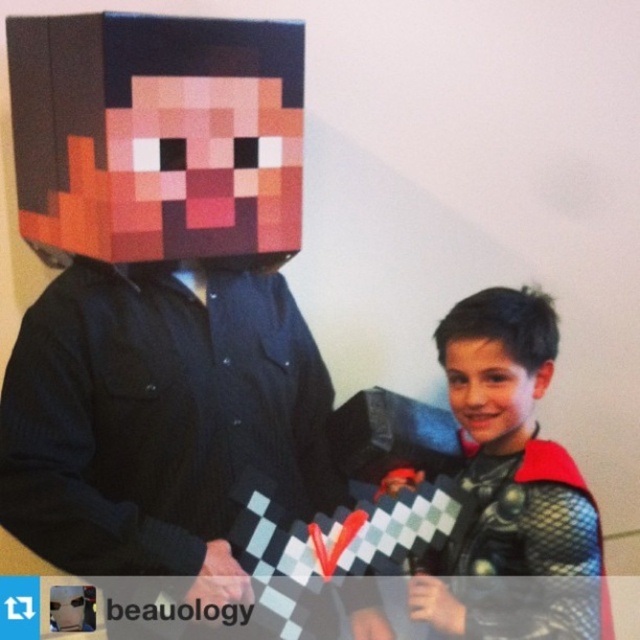
Question: Is matte black costume at center wider than smooth skin face at center?

Choices:
 (A) yes
 (B) no

Answer: (A)

Question: Observing the image, what is the correct spatial positioning of matte black costume at center in reference to dark brown hair at center?

Choices:
 (A) right
 (B) left

Answer: (A)

Question: Estimate the real-world distances between objects in this image. Which object is farther from the smooth skin face at center?

Choices:
 (A) matte black costume at center
 (B) dark brown hair at center

Answer: (A)

Question: Observing the image, what is the correct spatial positioning of dark brown hair at center in reference to smooth skin face at center?

Choices:
 (A) above
 (B) below

Answer: (A)

Question: Which is farther from the smooth skin face at center?

Choices:
 (A) dark brown hair at center
 (B) matte black costume at center

Answer: (B)

Question: Which point appears closest to the camera in this image?

Choices:
 (A) (493, 506)
 (B) (470, 381)
 (C) (515, 365)

Answer: (C)